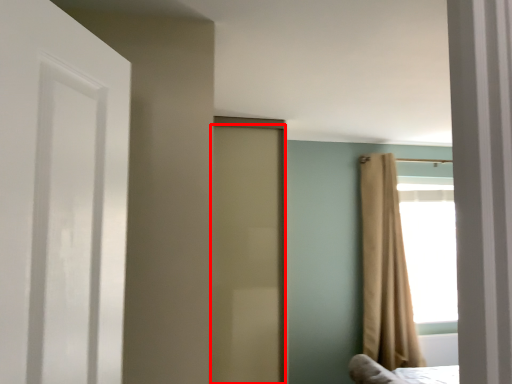
Question: From the image's perspective, what is the correct spatial relationship of door (annotated by the red box) in relation to curtain?

Choices:
 (A) below
 (B) above

Answer: (B)